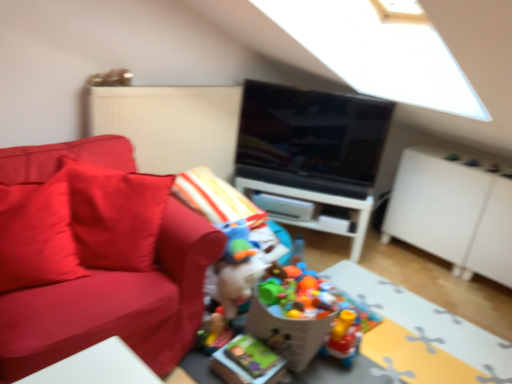
Find the location of a particular element. vacant area in front of translucent plastic toy at center, marked as the second toy in a back-to-front arrangement is located at coordinates (346, 370).